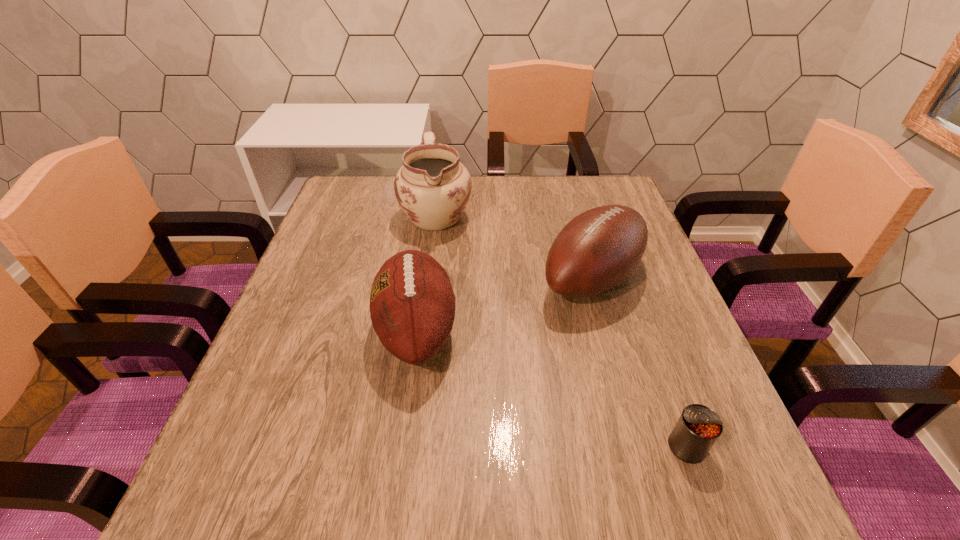
Where is `free area in between the right football (American) and the left football (American)`? free area in between the right football (American) and the left football (American) is located at coordinates (504, 305).

The image size is (960, 540). I want to click on free space between the left football (American) and the shortest object, so click(x=552, y=389).

Image resolution: width=960 pixels, height=540 pixels. I want to click on vacant space in between the right football (American) and the can, so click(639, 363).

Find the location of a particular element. This screenshot has width=960, height=540. vacant space that's between the left football (American) and the right football (American) is located at coordinates (504, 305).

The image size is (960, 540). In order to click on vacant area that lies between the can and the right football (American) in this screenshot , I will do `click(639, 363)`.

Find the location of `vacant space that's between the right football (American) and the nearest object`. vacant space that's between the right football (American) and the nearest object is located at coordinates (639, 363).

Identify which object is the third nearest to the farthest object. Please provide its 2D coordinates. Your answer should be formatted as a tuple, i.e. [(x, y)], where the tuple contains the x and y coordinates of a point satisfying the conditions above.

[(697, 429)]

Locate which object is the third closest to the farthest object. Please provide its 2D coordinates. Your answer should be formatted as a tuple, i.e. [(x, y)], where the tuple contains the x and y coordinates of a point satisfying the conditions above.

[(697, 429)]

Image resolution: width=960 pixels, height=540 pixels. I want to click on vacant space that satisfies the following two spatial constraints: 1. on the spout of the pitcher; 2. on the left side of the can, so click(406, 446).

Where is `vacant space that satisfies the following two spatial constraints: 1. on the spout of the can; 2. on the left side of the farthest object`? This screenshot has height=540, width=960. vacant space that satisfies the following two spatial constraints: 1. on the spout of the can; 2. on the left side of the farthest object is located at coordinates (406, 446).